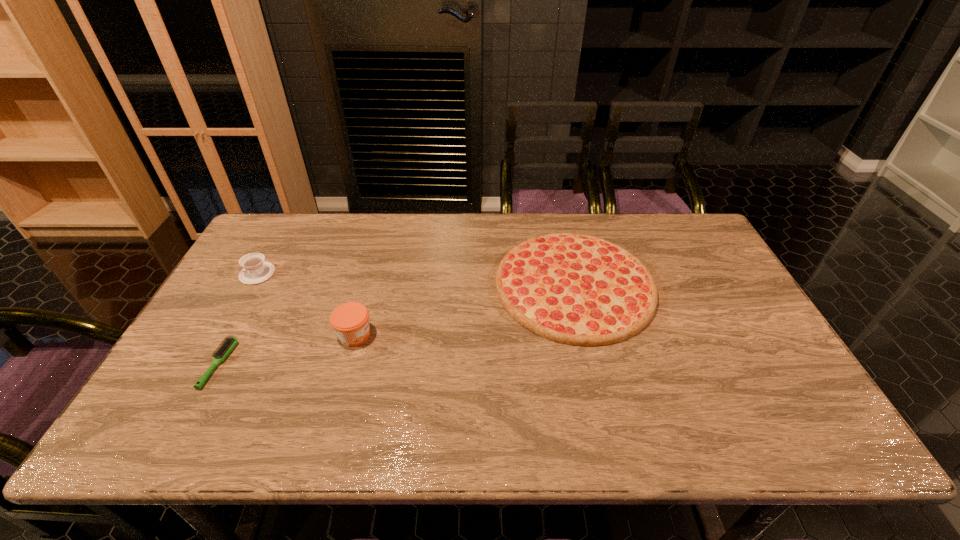
This screenshot has height=540, width=960. In order to click on hairbrush located in the left edge section of the desktop in this screenshot , I will do `click(223, 351)`.

Identify the location of vacant area at the far edge. The width and height of the screenshot is (960, 540). (650, 238).

Find the location of a particular element. free region at the near edge of the desktop is located at coordinates (716, 421).

At what (x,y) coordinates should I click in order to perform the action: click on vacant space at the left edge of the desktop. Please return your answer as a coordinate pair (x, y). The height and width of the screenshot is (540, 960). Looking at the image, I should click on (164, 409).

In the image, there is a desktop. Where is `free space at the right edge`? free space at the right edge is located at coordinates (728, 287).

Identify the location of vacant space at the far left corner of the desktop. This screenshot has width=960, height=540. (290, 213).

Where is `free spot between the pizza and the hairbrush`? This screenshot has width=960, height=540. free spot between the pizza and the hairbrush is located at coordinates (396, 325).

At what (x,y) coordinates should I click in order to perform the action: click on free area in between the second tallest object and the hairbrush. Please return your answer as a coordinate pair (x, y). Looking at the image, I should click on (x=238, y=319).

Where is `free space between the teacup and the shortest object`? free space between the teacup and the shortest object is located at coordinates (238, 319).

The image size is (960, 540). Find the location of `free space between the third object from left to right and the shortest object`. free space between the third object from left to right and the shortest object is located at coordinates (287, 350).